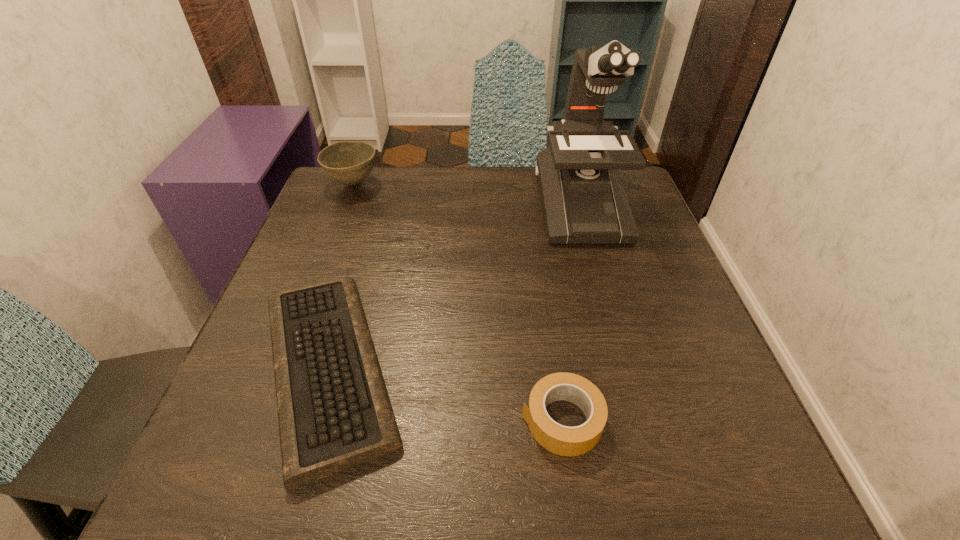
What are the coordinates of `blank region between the tallest object and the shortest object` in the screenshot? It's located at (454, 286).

What are the coordinates of `vacant region between the tallest object and the computer keyboard` in the screenshot? It's located at (454, 286).

Locate an element on the screen. This screenshot has width=960, height=540. vacant point located between the duct tape and the microscope is located at coordinates (571, 312).

This screenshot has width=960, height=540. In order to click on unoccupied position between the tallest object and the computer keyboard in this screenshot , I will do `click(454, 286)`.

Image resolution: width=960 pixels, height=540 pixels. In order to click on free spot between the second tallest object and the microscope in this screenshot , I will do `click(467, 194)`.

Find the location of a particular element. The height and width of the screenshot is (540, 960). empty space between the tallest object and the computer keyboard is located at coordinates (454, 286).

You are a GUI agent. You are given a task and a screenshot of the screen. Output one action in this format:
    pyautogui.click(x=<x>, y=<y>)
    Task: Click on the vacant area that lies between the shortest object and the microscope
    This screenshot has width=960, height=540.
    Given the screenshot: What is the action you would take?
    pyautogui.click(x=454, y=286)

Where is `object that ranks as the closest to the computer keyboard`? object that ranks as the closest to the computer keyboard is located at coordinates (562, 440).

Identify which object is the second nearest to the tallest object. Please provide its 2D coordinates. Your answer should be formatted as a tuple, i.e. [(x, y)], where the tuple contains the x and y coordinates of a point satisfying the conditions above.

[(562, 440)]

Identify the location of blank area in the image that satisfies the following two spatial constraints: 1. through the eyepieces of the microscope; 2. at the edge of the duct tape. (640, 420).